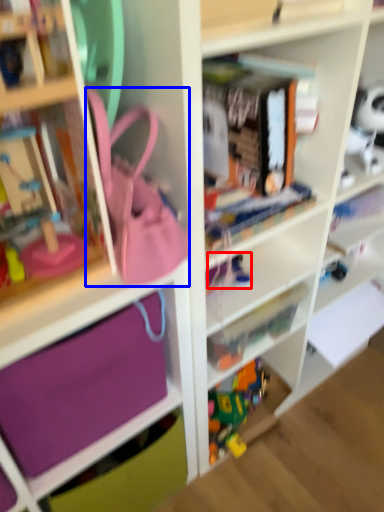
Question: Which object appears farthest to the camera in this image, toy (highlighted by a red box) or accessory (highlighted by a blue box)?

Choices:
 (A) toy
 (B) accessory

Answer: (A)